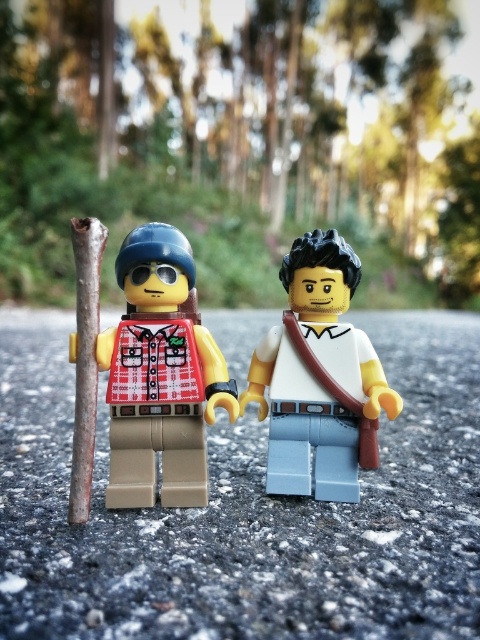
Question: Does matte yellow figure at left appear under white matte shirt at center?

Choices:
 (A) yes
 (B) no

Answer: (B)

Question: Which object is closer to the camera taking this photo?

Choices:
 (A) white matte shirt at center
 (B) matte yellow figure at left

Answer: (B)

Question: Can you confirm if matte yellow figure at left is bigger than white matte shirt at center?

Choices:
 (A) no
 (B) yes

Answer: (B)

Question: Which object is closer to the camera taking this photo?

Choices:
 (A) matte yellow figure at left
 (B) white matte shirt at center

Answer: (A)

Question: In this image, where is matte yellow figure at left located relative to white matte shirt at center?

Choices:
 (A) below
 (B) above

Answer: (B)